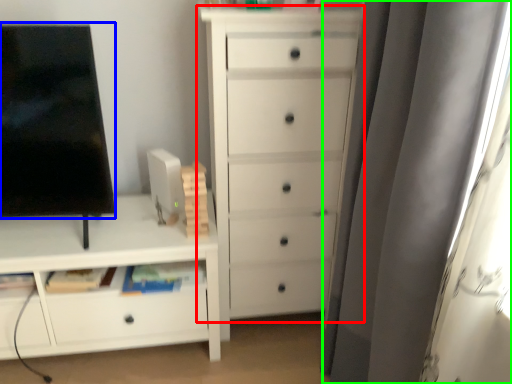
Question: Estimate the real-world distances between objects in this image. Which object is closer to chest of drawers (highlighted by a red box), screen (highlighted by a blue box) or curtain (highlighted by a green box)?

Choices:
 (A) screen
 (B) curtain

Answer: (B)